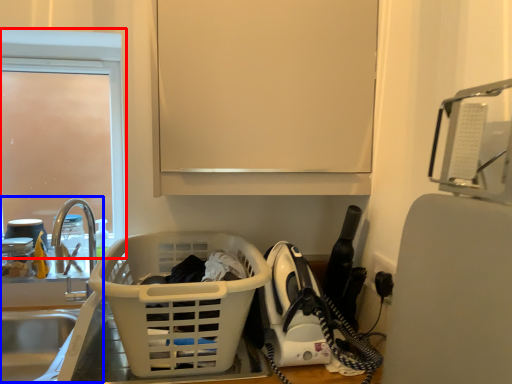
Question: Which point is further to the camera, glass door (highlighted by a red box) or sink (highlighted by a blue box)?

Choices:
 (A) glass door
 (B) sink

Answer: (A)